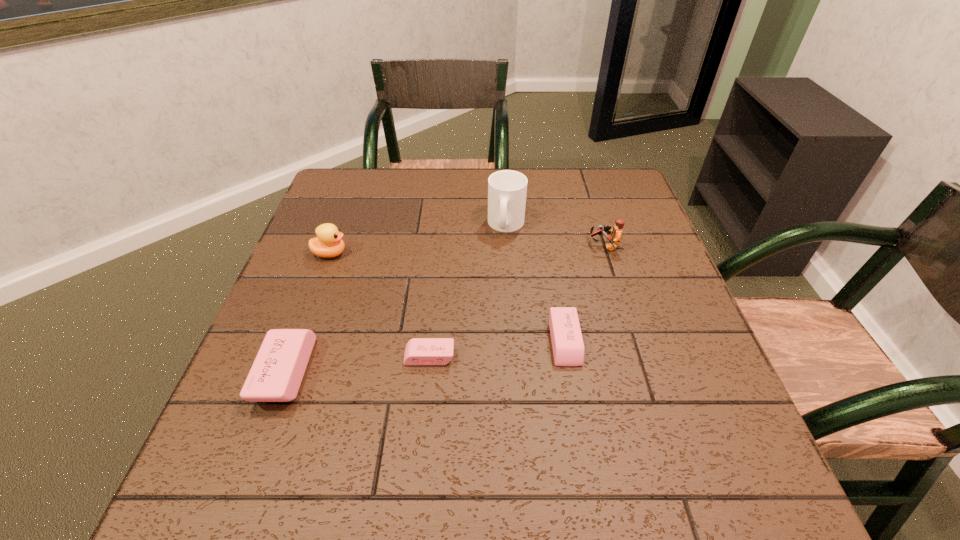
Where is `free space that satisfies the following two spatial constraints: 1. on the face of the duckling; 2. on the back side of the shortest object`? free space that satisfies the following two spatial constraints: 1. on the face of the duckling; 2. on the back side of the shortest object is located at coordinates (292, 356).

Identify the location of free space that satisfies the following two spatial constraints: 1. on the handle side of the tallest object; 2. on the right side of the fifth tallest object. (515, 342).